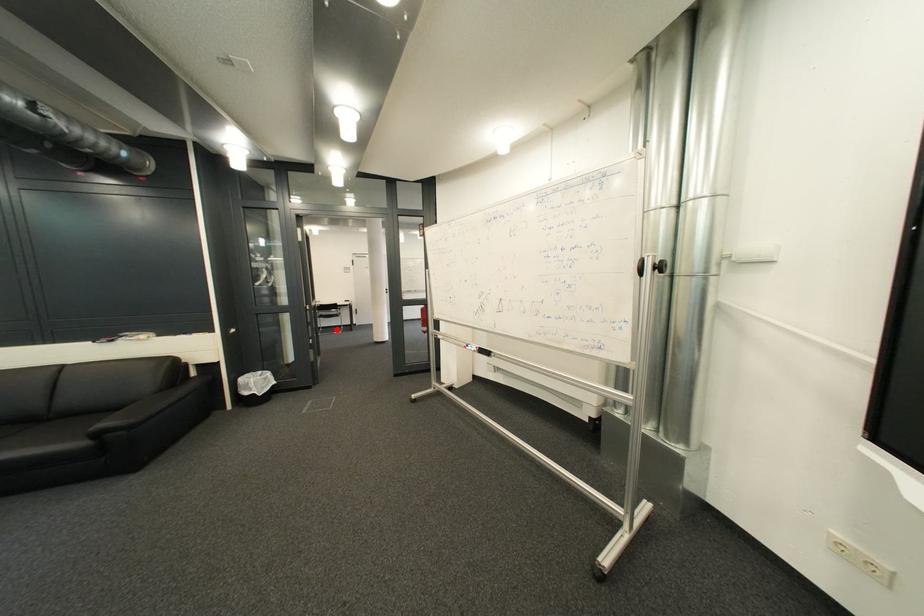
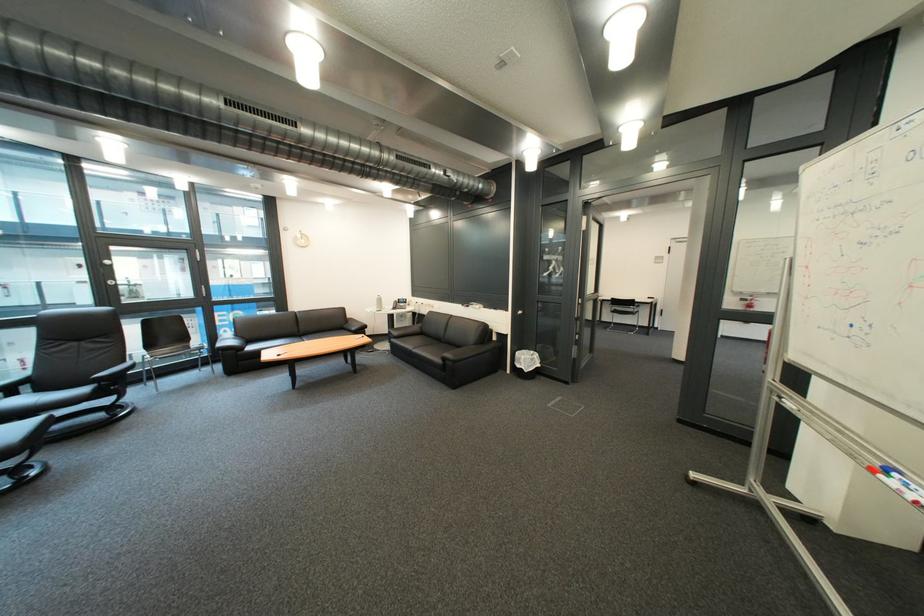
Question: I am providing you with two images of the same scene from different viewpoints. A red point is shown in image1. For the corresponding object point in image2, is it positioned nearer or farther from the camera?

Choices:
 (A) Nearer
 (B) Farther

Answer: (B)